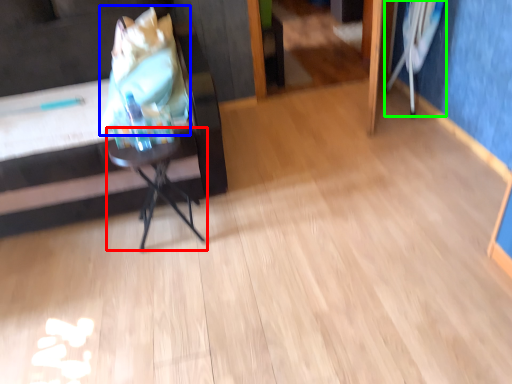
Question: Based on their relative distances, which object is nearer to table (highlighted by a red box)? Choose from grocery bag (highlighted by a blue box) and swivel chair (highlighted by a green box).

Choices:
 (A) grocery bag
 (B) swivel chair

Answer: (A)